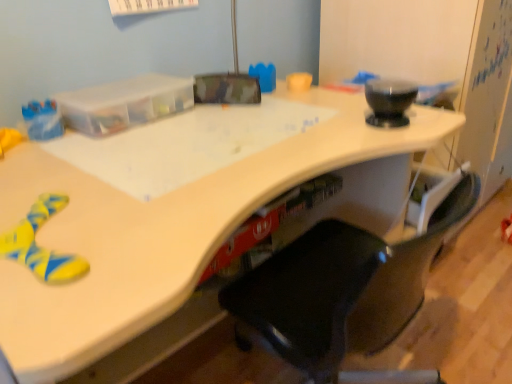
Where is `vacant space behind rubberized red toy at lower right`? The height and width of the screenshot is (384, 512). vacant space behind rubberized red toy at lower right is located at coordinates (487, 220).